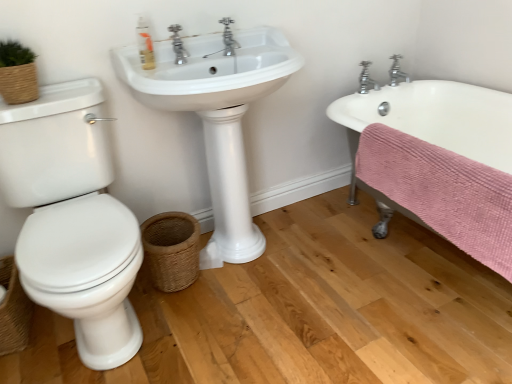
You are a GUI agent. You are given a task and a screenshot of the screen. Output one action in this format:
    pyautogui.click(x=<x>, y=<y>)
    Task: Click on the vacant area that is situated to the right of white glossy sink at center
    
    Given the screenshot: What is the action you would take?
    pyautogui.click(x=338, y=261)